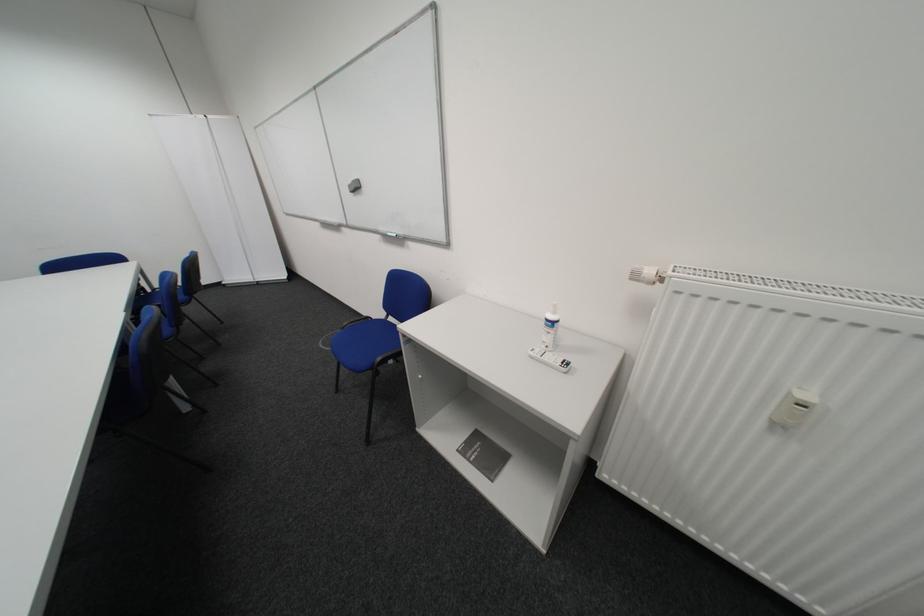
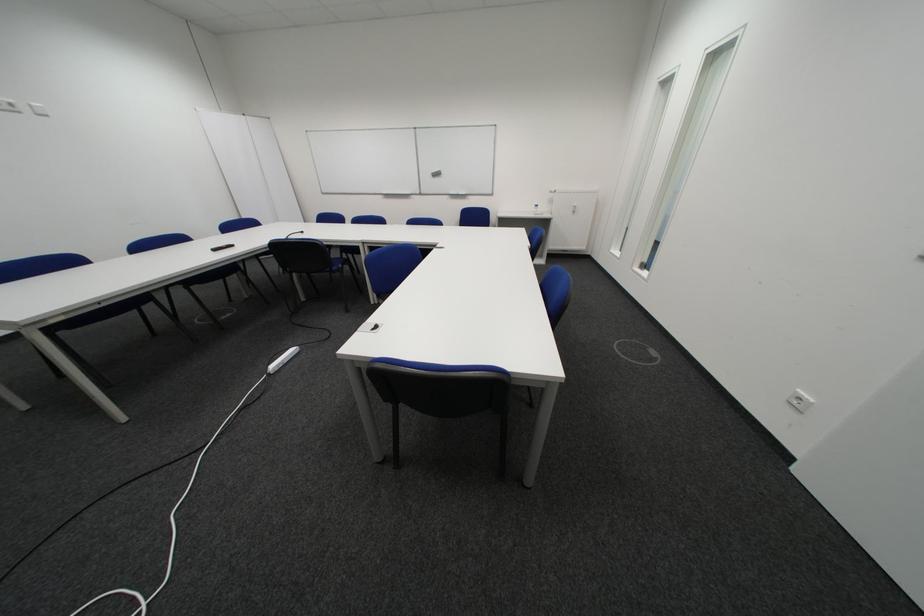
In the second image, find the point that corresponds to point (548, 354) in the first image.

(548, 215)